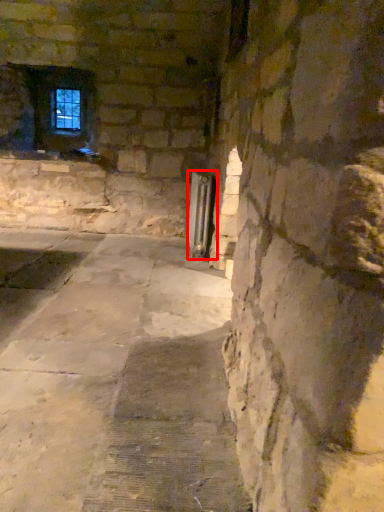
Question: Where is elevator (annotated by the red box) located in relation to window frame in the image?

Choices:
 (A) left
 (B) right

Answer: (B)